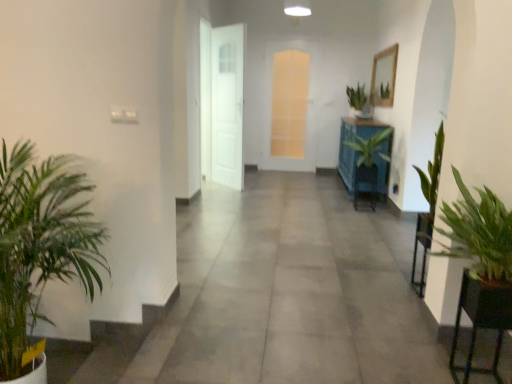
What do you see at coordinates (364, 155) in the screenshot? I see `green glossy plant at center, the 2th houseplant viewed from the right` at bounding box center [364, 155].

Image resolution: width=512 pixels, height=384 pixels. What do you see at coordinates (41, 243) in the screenshot? I see `green leafy plant at left, marked as the first houseplant in a front-to-back arrangement` at bounding box center [41, 243].

I want to click on green leafy plant at right, so click(x=481, y=321).

You are a GUI agent. You are given a task and a screenshot of the screen. Output one action in this format:
    pyautogui.click(x=<x>, y=<y>)
    Task: Click on the white glossy door at center, the 2th door in the back-to-front sequence
    
    Given the screenshot: What is the action you would take?
    pyautogui.click(x=227, y=105)

This screenshot has height=384, width=512. Describe the element at coordinates (359, 101) in the screenshot. I see `green matte plant at center, the first houseplant viewed from the right` at that location.

Identify the location of green glossy plant at center, marked as the 3th houseplant in a front-to-back arrangement. [x=364, y=155].

Is point (356, 114) positioned after point (233, 48)?

Yes, point (356, 114) is behind point (233, 48).

Considering the sizes of objects green matte plant at center, which is counted as the 4th houseplant, starting from the left, and white glossy door at center, which ranks as the 1th door in front-to-back order, in the image provided, who is shorter, green matte plant at center, which is counted as the 4th houseplant, starting from the left, or white glossy door at center, which ranks as the 1th door in front-to-back order,?

green matte plant at center, which is counted as the 4th houseplant, starting from the left.

From the image's perspective, relative to white glossy door at center, which ranks as the 1th door in front-to-back order, is green matte plant at center, which is counted as the 4th houseplant, starting from the left, above or below?

Based on their image positions, green matte plant at center, which is counted as the 4th houseplant, starting from the left, is located above white glossy door at center, which ranks as the 1th door in front-to-back order.

Is white glossy door at center, the 2th door in the back-to-front sequence, inside green matte plant at center, the first houseplant viewed from the right?

No.

Between green leafy plant at right, the 3th houseplant in the right-to-left sequence, and green leafy plant at left, which one has more height?

green leafy plant at right, the 3th houseplant in the right-to-left sequence.

Identify the location of the 1st houseplant to the right when counting from the green leafy plant at left. (478, 234).

Could you tell me if green leafy plant at right, marked as the 3th houseplant in a back-to-front arrangement, is turned towards green leafy plant at left?

No, green leafy plant at right, marked as the 3th houseplant in a back-to-front arrangement, is not turned towards green leafy plant at left.

From a real-world perspective, which is physically above, green leafy plant at left or green matte plant at center, the first houseplant viewed from the right?

In real-world perspective, green matte plant at center, the first houseplant viewed from the right, is above.

From the image's perspective, does green leafy plant at left appear higher than green matte plant at center, acting as the fourth houseplant starting from the front?

No, from the image's perspective, green leafy plant at left is not on top of green matte plant at center, acting as the fourth houseplant starting from the front.

Is point (394, 352) closer to viewer compared to point (355, 108)?

That is True.

Is green leafy plant at left wider or thinner than green matte plant at center, which is counted as the 4th houseplant, starting from the left?

Considering their sizes, green leafy plant at left looks broader than green matte plant at center, which is counted as the 4th houseplant, starting from the left.

Is green leafy plant at right surrounding green leafy plant at left?

No, green leafy plant at left is not a part of green leafy plant at right.

Would you consider green leafy plant at right to be distant from green leafy plant at left?

green leafy plant at right is far away from green leafy plant at left.

Is green leafy plant at right in front of or behind green leafy plant at left in the image?

green leafy plant at right is positioned farther from the viewer than green leafy plant at left.

In the scene shown: Can you confirm if green leafy plant at right is positioned to the right of green leafy plant at left?

Correct, you'll find green leafy plant at right to the right of green leafy plant at left.

From the image's perspective, is green leafy plant at right located above or below green glossy plant at center, positioned as the 2th houseplant in back-to-front order?

green leafy plant at right is situated lower than green glossy plant at center, positioned as the 2th houseplant in back-to-front order, in the image.

Based on the photo, can green glossy plant at center, marked as the 3th houseplant in a front-to-back arrangement, be found inside green leafy plant at right?

Definitely not — green glossy plant at center, marked as the 3th houseplant in a front-to-back arrangement, is not inside green leafy plant at right.

Between green leafy plant at right and green glossy plant at center, the 2th houseplant viewed from the right, which one has larger size?

green glossy plant at center, the 2th houseplant viewed from the right.

Looking at their sizes, would you say green leafy plant at right is wider or thinner than green glossy plant at center, marked as the 3th houseplant in a front-to-back arrangement?

Clearly, green leafy plant at right has less width compared to green glossy plant at center, marked as the 3th houseplant in a front-to-back arrangement.

From the image's perspective, between green matte plant at center, which is counted as the 4th houseplant, starting from the left, and translucent glass door at center, positioned as the 1th door in right-to-left order, which one is located above?

green matte plant at center, which is counted as the 4th houseplant, starting from the left, appears higher in the image.

Is green matte plant at center, which is counted as the 4th houseplant, starting from the left, oriented towards translucent glass door at center, the 1th door when ordered from back to front?

Yes, green matte plant at center, which is counted as the 4th houseplant, starting from the left, is aimed at translucent glass door at center, the 1th door when ordered from back to front.

Is green matte plant at center, the first houseplant positioned from the back, in front of or behind translucent glass door at center, positioned as the 1th door in right-to-left order, in the image?

green matte plant at center, the first houseplant positioned from the back, is positioned closer to the viewer than translucent glass door at center, positioned as the 1th door in right-to-left order.

Consider the image. Is green glossy plant at center, marked as the 3th houseplant in a front-to-back arrangement, not near green leafy plant at right, which is counted as the second houseplant, starting from the front?

Yes.

Considering the relative sizes of green glossy plant at center, positioned as the 2th houseplant in back-to-front order, and green leafy plant at right, marked as the 3th houseplant in a back-to-front arrangement, in the image provided, is green glossy plant at center, positioned as the 2th houseplant in back-to-front order, shorter than green leafy plant at right, marked as the 3th houseplant in a back-to-front arrangement,?

Incorrect, the height of green glossy plant at center, positioned as the 2th houseplant in back-to-front order, does not fall short of that of green leafy plant at right, marked as the 3th houseplant in a back-to-front arrangement.

How far apart are green glossy plant at center, marked as the 3th houseplant in a front-to-back arrangement, and green leafy plant at right, the 3th houseplant in the right-to-left sequence?

They are 9.30 feet apart.

Image resolution: width=512 pixels, height=384 pixels. I want to click on the 2nd door below when counting from the green matte plant at center, the first houseplant positioned from the back (from the image's perspective), so click(x=227, y=105).

The width and height of the screenshot is (512, 384). There is a green leafy plant at left. Identify the location of the 1st houseplant above it (from the image's perspective). (478, 234).

Based on their spatial positions, is white glossy door at center, marked as the 2th door in a right-to-left arrangement, or green glossy plant at center, the 2th houseplant viewed from the right, closer to green leafy plant at left?

green glossy plant at center, the 2th houseplant viewed from the right.

Based on their spatial positions, is green matte plant at center, acting as the fourth houseplant starting from the front, or green leafy plant at left closer to translucent glass door at center, the 2th door when ordered from left to right?

The object closer to translucent glass door at center, the 2th door when ordered from left to right, is green matte plant at center, acting as the fourth houseplant starting from the front.

When comparing their distances from green leafy plant at right, does green matte plant at center, the first houseplant positioned from the back, or translucent glass door at center, positioned as the 1th door in right-to-left order, seem further?

translucent glass door at center, positioned as the 1th door in right-to-left order, lies further to green leafy plant at right than the other object.

Based on their spatial positions, is green leafy plant at right or green leafy plant at left further from green matte plant at center, the first houseplant positioned from the back?

Among the two, green leafy plant at right is located further to green matte plant at center, the first houseplant positioned from the back.

When comparing their distances from green leafy plant at right, does translucent glass door at center, the 2th door when ordered from left to right, or green leafy plant at left seem closer?

green leafy plant at left lies closer to green leafy plant at right than the other object.

Based on their spatial positions, is green leafy plant at right or green glossy plant at center, positioned as the 2th houseplant in back-to-front order, further from translucent glass door at center, positioned as the 1th door in right-to-left order?

green leafy plant at right.

Which object lies nearer to the anchor point green leafy plant at left, green leafy plant at right or white glossy door at center, the 2th door in the back-to-front sequence?

The object closer to green leafy plant at left is green leafy plant at right.

Looking at the image, which one is located closer to green leafy plant at right, marked as the 3th houseplant in a back-to-front arrangement, green leafy plant at left or white glossy door at center, which ranks as the 1th door in front-to-back order?

The object closer to green leafy plant at right, marked as the 3th houseplant in a back-to-front arrangement, is green leafy plant at left.

This screenshot has width=512, height=384. I want to click on houseplant between green leafy plant at right, the 3th houseplant in the right-to-left sequence, and green matte plant at center, acting as the fourth houseplant starting from the front, along the z-axis, so click(364, 155).

The height and width of the screenshot is (384, 512). I want to click on furniture positioned between green leafy plant at left and white glossy door at center, which ranks as the 1th door in front-to-back order, from near to far, so click(481, 321).

This screenshot has height=384, width=512. I want to click on furniture positioned between green leafy plant at right, the 2th houseplant from the left, and white glossy door at center, marked as the 2th door in a right-to-left arrangement, from near to far, so click(x=481, y=321).

Where is `door between green leafy plant at right and translucent glass door at center, positioned as the 1th door in right-to-left order, from front to back`? The image size is (512, 384). door between green leafy plant at right and translucent glass door at center, positioned as the 1th door in right-to-left order, from front to back is located at coordinates (227, 105).